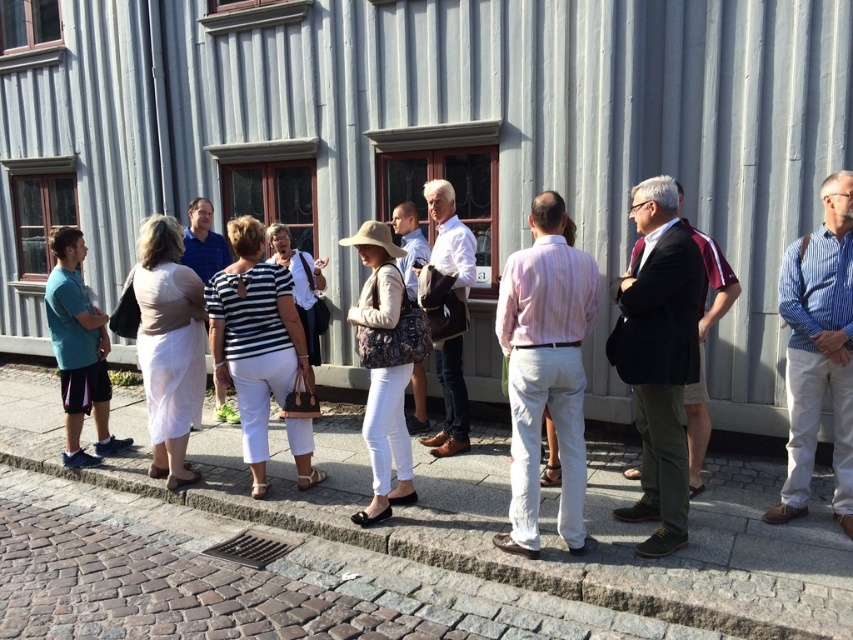
You are standing at the point labeled as point (490, 556) in the image. What object are you standing on?

You are standing on the gray concrete curb at lower center.

You are standing at the entrance of the building and want to walk to the gray concrete curb at lower center. What are the coordinates of the curb to guide your path?

The coordinates of the gray concrete curb at lower center are at point (x=490, y=556).

You are a photographer trying to capture a photo of the striped cotton shirt at center and the gray concrete curb at lower center. Which object should you focus on first if you want to ensure both are in the frame without moving the camera?

You should focus on the gray concrete curb at lower center first because it is larger than the striped cotton shirt at center, making it easier to center in the frame while still capturing the smaller shirt in the background.